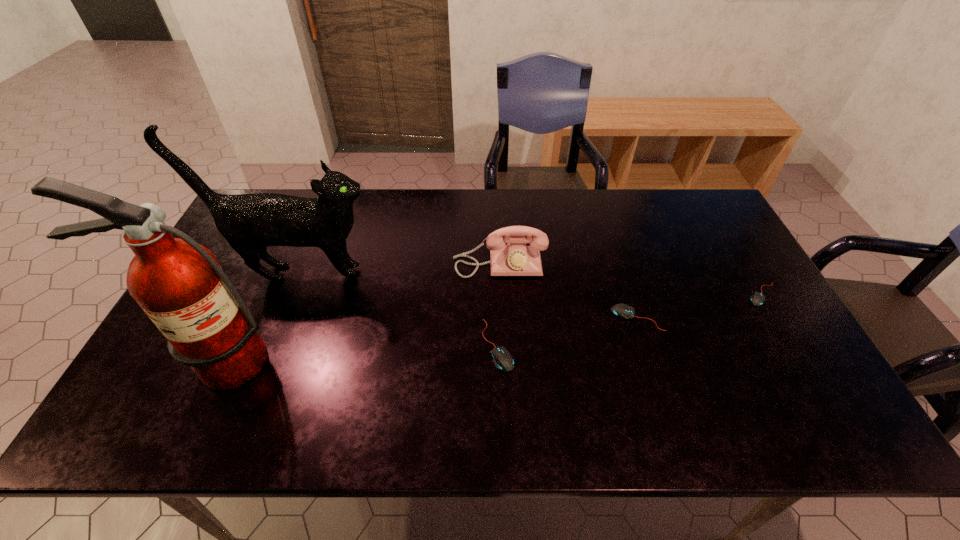
In order to click on the leftmost mouse in this screenshot , I will do `click(503, 360)`.

In order to click on the fifth object from left to right in this screenshot , I will do `click(624, 311)`.

Where is `the fifth tallest object`? the fifth tallest object is located at coordinates (624, 311).

Locate an element on the screen. This screenshot has width=960, height=540. the shortest mouse is located at coordinates (757, 299).

Where is `the shortest object`? The width and height of the screenshot is (960, 540). the shortest object is located at coordinates (757, 299).

The height and width of the screenshot is (540, 960). In order to click on cat in this screenshot , I will do `click(249, 222)`.

I want to click on the third tallest object, so click(516, 258).

Locate an element on the screen. fire extinguisher is located at coordinates (179, 284).

Where is `vacant space located 0.050m on the back of the leftmost mouse`? The image size is (960, 540). vacant space located 0.050m on the back of the leftmost mouse is located at coordinates (496, 305).

Where is `blank area located 0.210m on the left of the second object from right to left`? This screenshot has height=540, width=960. blank area located 0.210m on the left of the second object from right to left is located at coordinates (534, 318).